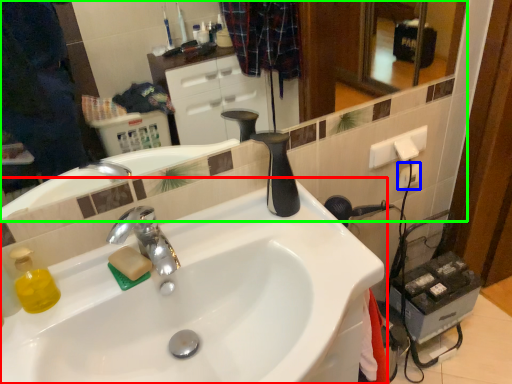
Question: Based on their relative distances, which object is farther from sink (highlighted by a red box)? Choose from electric outlet (highlighted by a blue box) and mirror (highlighted by a green box).

Choices:
 (A) electric outlet
 (B) mirror

Answer: (B)